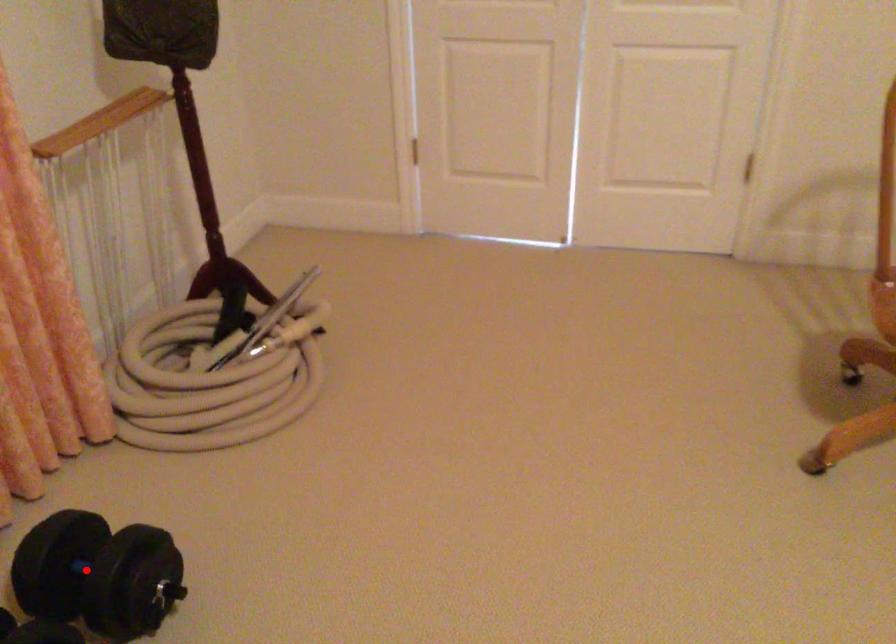
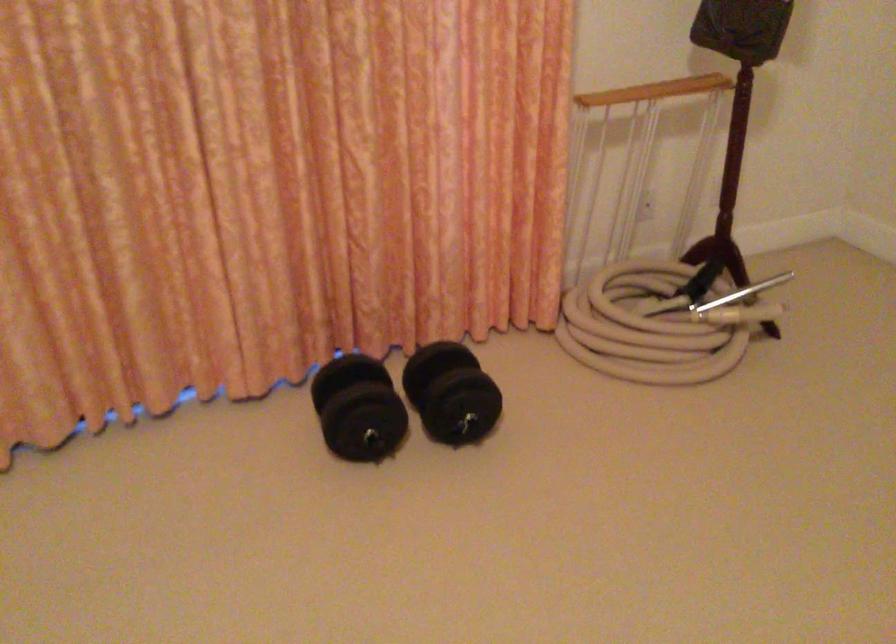
Where in the second image is the point corresponding to the highlighted location from the first image?

(451, 393)